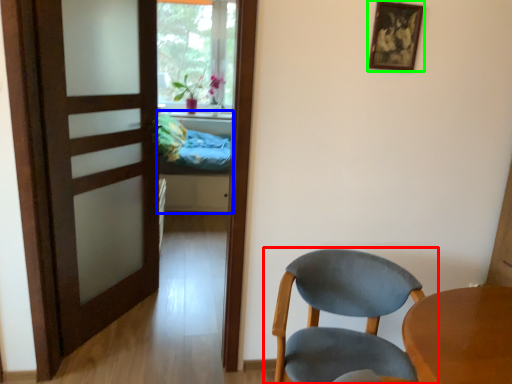
Question: Which is farther away from chair (highlighted by a red box)? bed (highlighted by a blue box) or picture frame (highlighted by a green box)?

Choices:
 (A) bed
 (B) picture frame

Answer: (A)